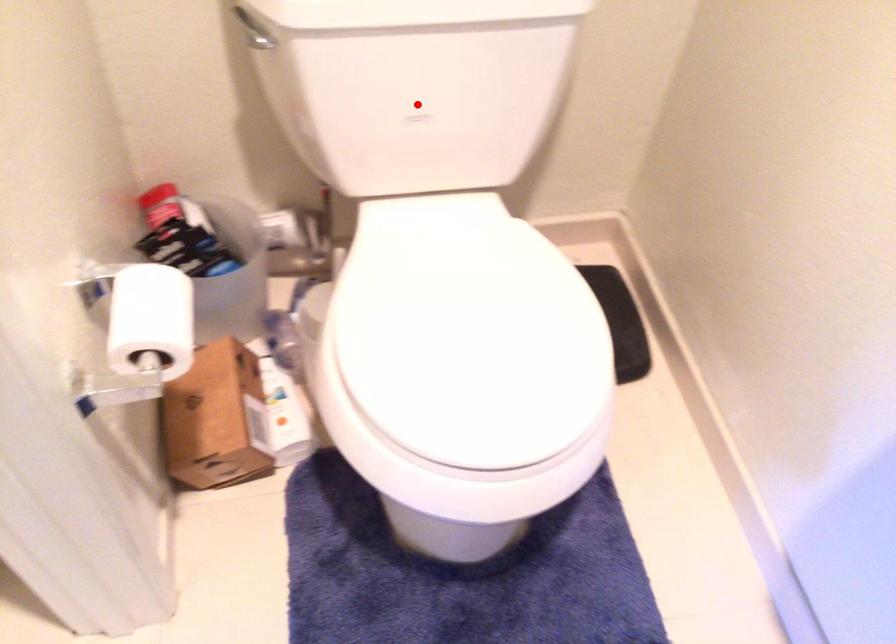
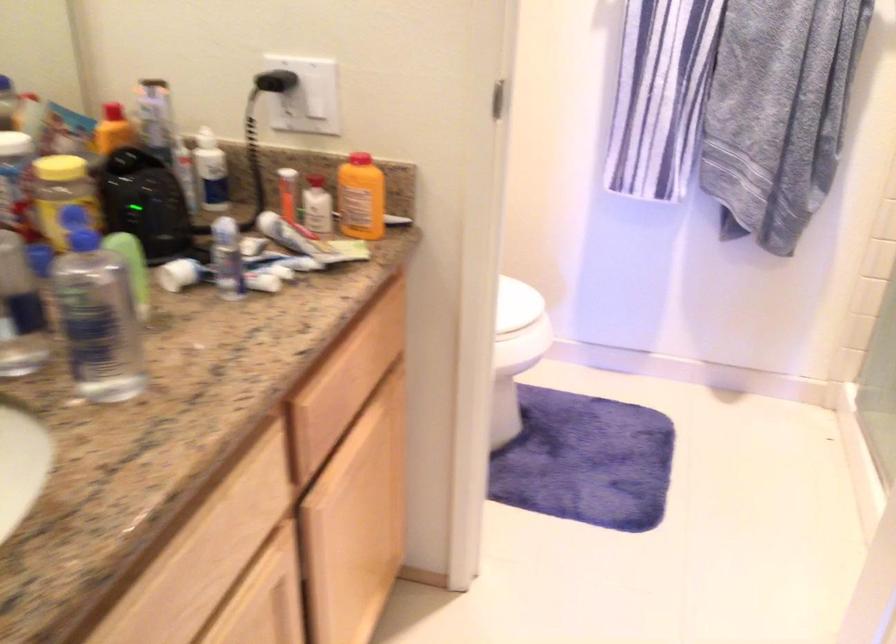
Question: I am providing you with two images of the same scene from different viewpoints. A red point is marked on the first image. Is the red point's position out of view in image 2?

Choices:
 (A) Yes
 (B) No

Answer: (A)